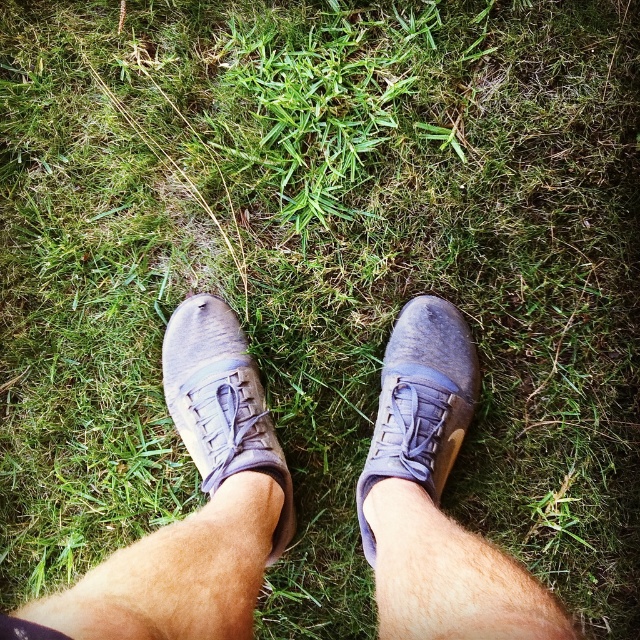
You are standing in the grass and see two points marked on the ground. One is at point (x=250, y=440) and the other at point (x=416, y=328). If you face forward, which point is closer to you?

Point (x=250, y=440) is in front of point (x=416, y=328), so if you face forward, the point (x=250, y=440) is closer to you.

You are a delivery robot that needs to deliver a package to the person standing in front of you. The robot has a height of 3 feet. The person is wearing leather shoes at center. Can the robot see the person above the shoes?

The leather shoes at center and viewer are 23.44 inches apart. Since the robot is 3 feet tall, which is 36 inches, it can see above the shoes as the distance between them is less than the robot height.

You are standing in a park and see your friend who is at point [237,547]. If you want to throw a small pebble to them, and you can throw up to 3 feet, will you be able to reach them?

The distance between you and point [237,547] is 3.31 feet, which is beyond your throwing range of 3 feet. You won not be able to reach them.